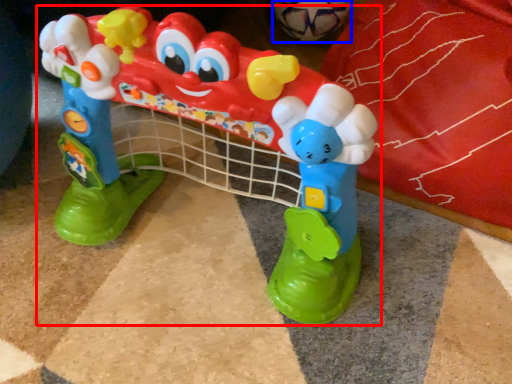
Question: Which object appears closest to the camera in this image, toy (highlighted by a red box) or toy (highlighted by a blue box)?

Choices:
 (A) toy
 (B) toy

Answer: (A)